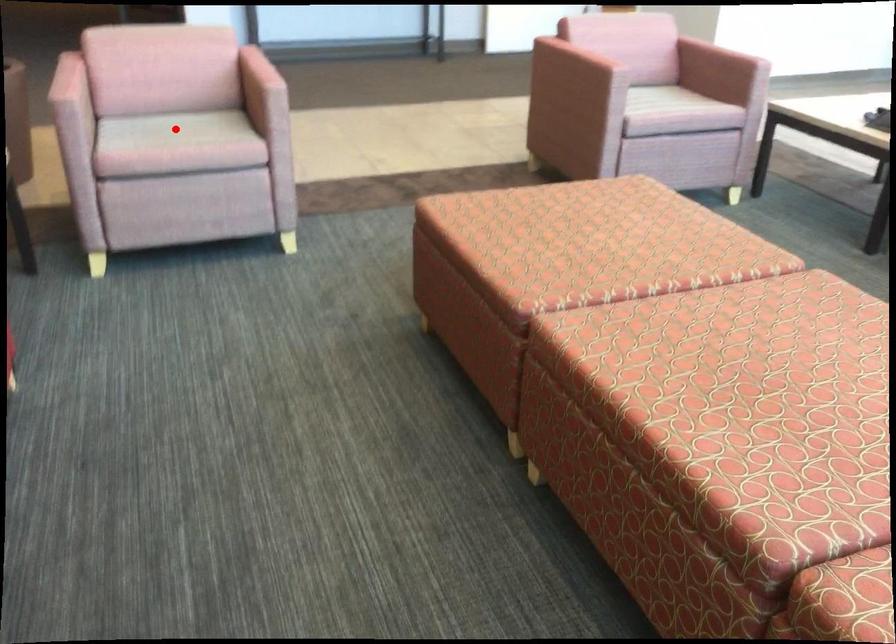
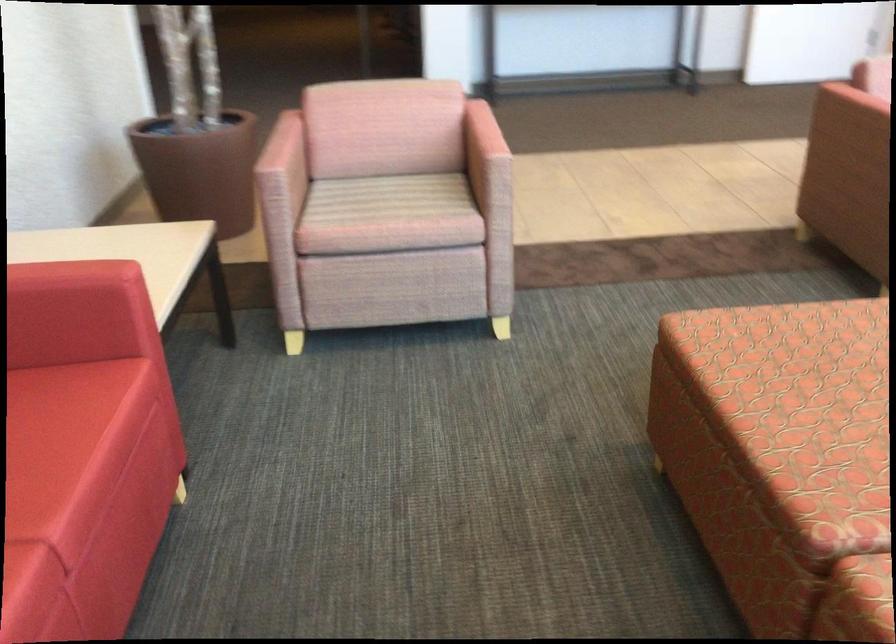
Question: I am providing you with two images of the same scene from different viewpoints. Image1 has a red point marked. In image2, the corresponding 3D location appears at what relative position? Reply with the corresponding letter.

Choices:
 (A) Closer
 (B) Farther

Answer: (A)